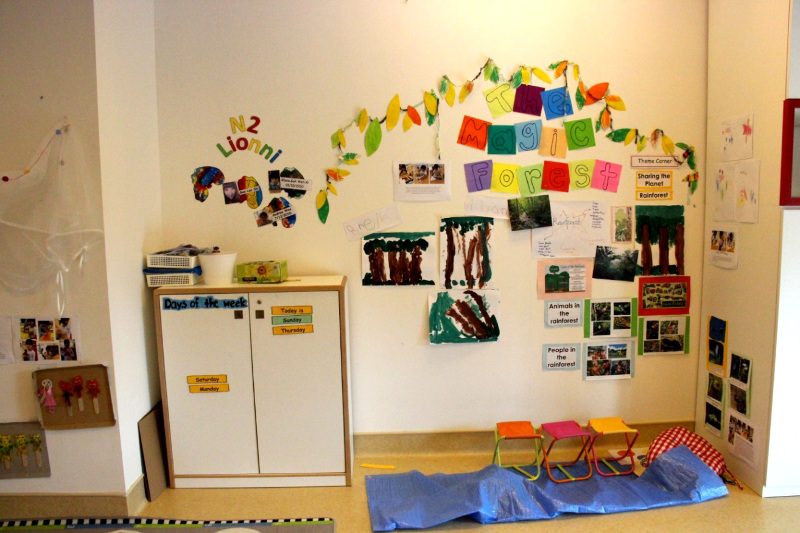
Image resolution: width=800 pixels, height=533 pixels. Find the location of `pillar`. pillar is located at coordinates (90, 312), (748, 332).